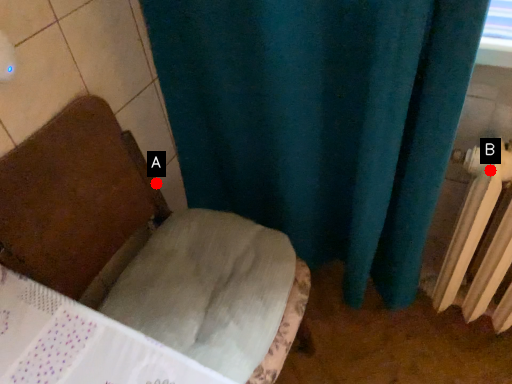
Question: Two points are circled on the image, labeled by A and B beside each circle. Which of the following is the closest to the observer?

Choices:
 (A) A is closer
 (B) B is closer

Answer: (B)